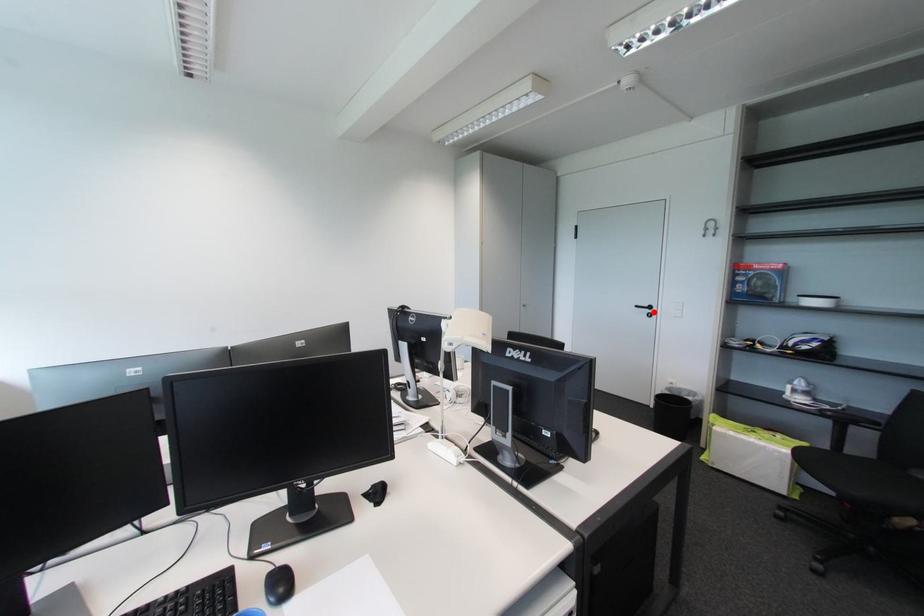
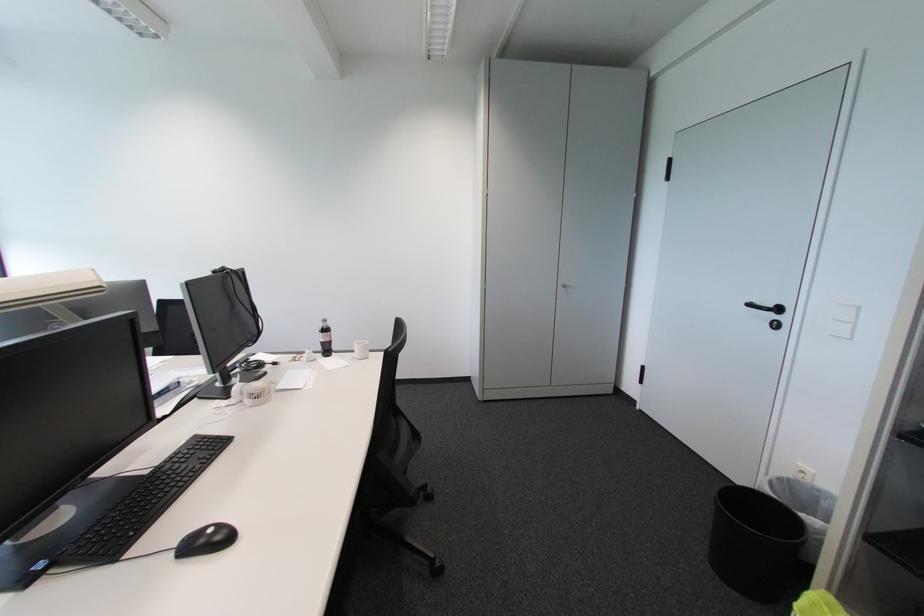
The point at the highlighted location is marked in the first image. Where is the corresponding point in the second image?

(777, 317)